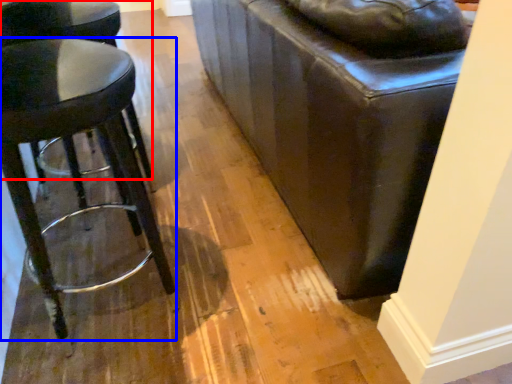
Question: Which point is closer to the camera, stool (highlighted by a red box) or stool (highlighted by a blue box)?

Choices:
 (A) stool
 (B) stool

Answer: (B)